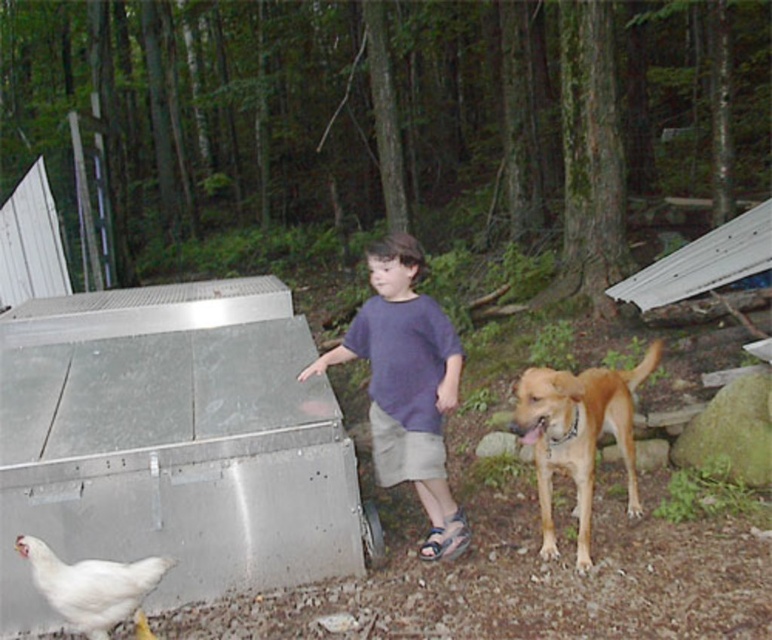
Question: Which object is positioned closest to the purple cotton shirt at center?

Choices:
 (A) white matte chicken at lower left
 (B) golden fur dog at center

Answer: (B)

Question: Does purple cotton shirt at center appear over white matte chicken at lower left?

Choices:
 (A) yes
 (B) no

Answer: (A)

Question: Which object is the farthest from the white matte chicken at lower left?

Choices:
 (A) purple cotton shirt at center
 (B) golden fur dog at center

Answer: (B)

Question: Is purple cotton shirt at center below golden fur dog at center?

Choices:
 (A) no
 (B) yes

Answer: (A)

Question: Which is nearer to the golden fur dog at center?

Choices:
 (A) purple cotton shirt at center
 (B) white matte chicken at lower left

Answer: (A)

Question: Can you confirm if golden fur dog at center is positioned to the left of white matte chicken at lower left?

Choices:
 (A) no
 (B) yes

Answer: (A)